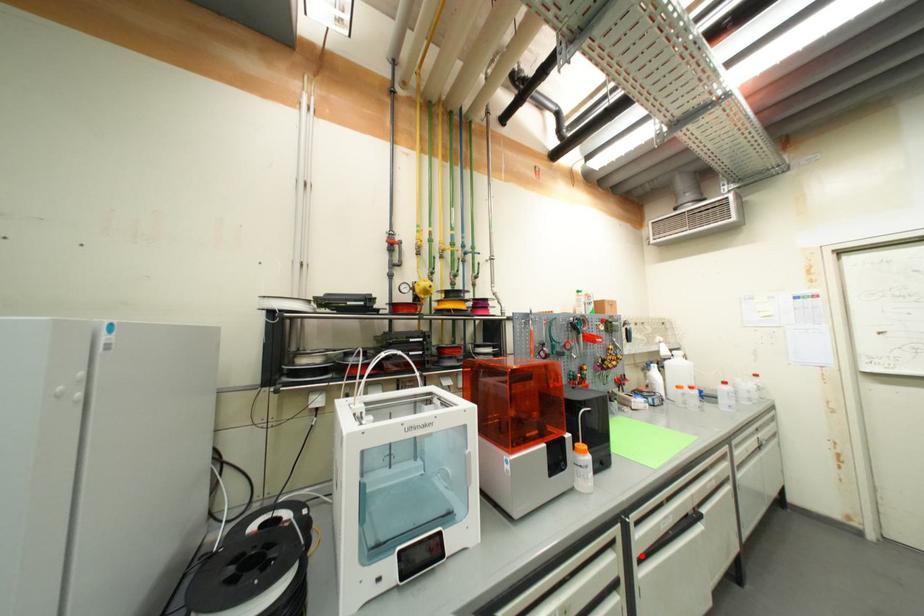
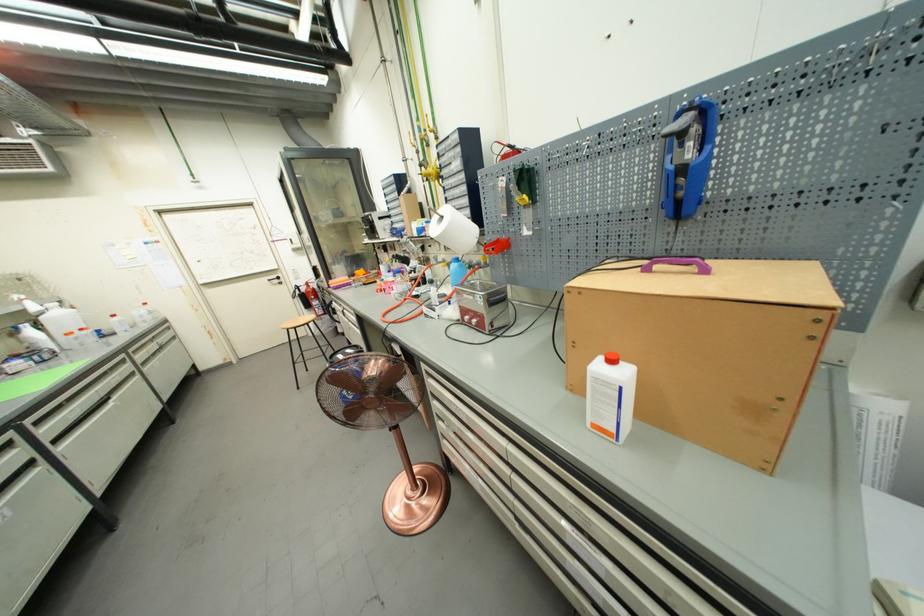
Locate, in the second image, the point that corresponds to the highlighted location in the first image.

(52, 440)